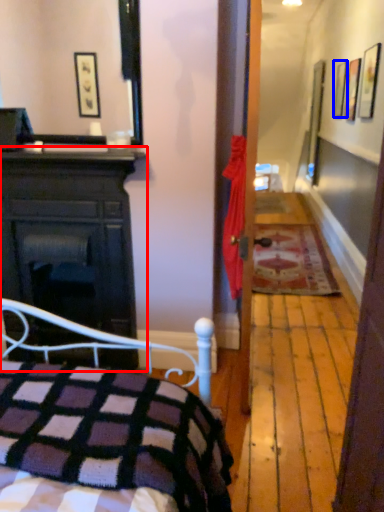
Question: Which object appears closest to the camera in this image, cabinetry (highlighted by a red box) or picture frame (highlighted by a blue box)?

Choices:
 (A) cabinetry
 (B) picture frame

Answer: (A)